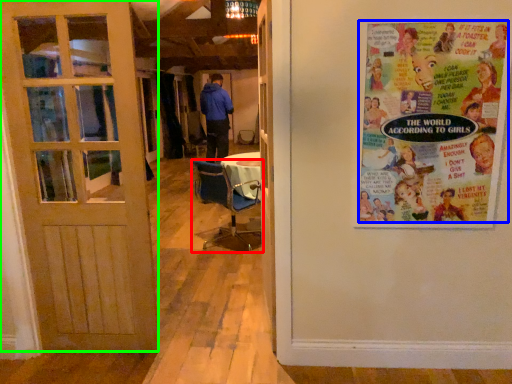
Question: Which object is the farthest from chair (highlighted by a red box)? Choose among these: poster (highlighted by a blue box) or door (highlighted by a green box).

Choices:
 (A) poster
 (B) door

Answer: (A)